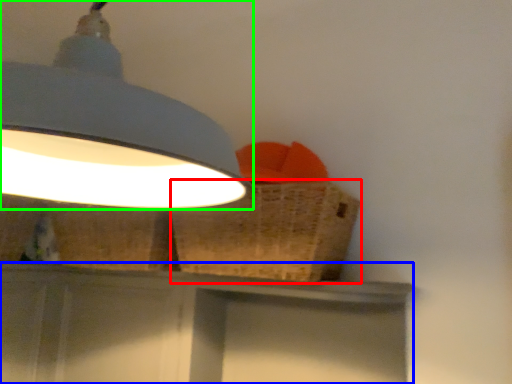
Question: Which object is the farthest from basket (highlighted by a red box)? Choose among these: vanity (highlighted by a blue box) or lamp (highlighted by a green box).

Choices:
 (A) vanity
 (B) lamp

Answer: (B)